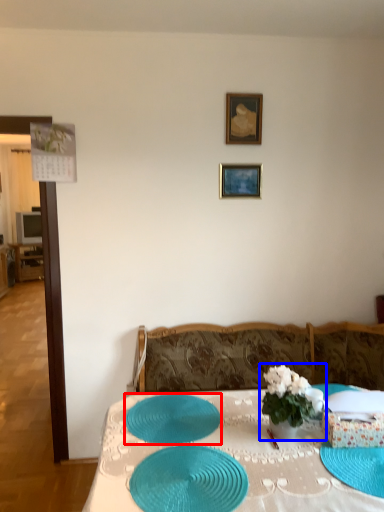
Question: Among these objects, which one is nearest to the camera, tableware (highlighted by a red box) or houseplant (highlighted by a blue box)?

Choices:
 (A) tableware
 (B) houseplant

Answer: (B)